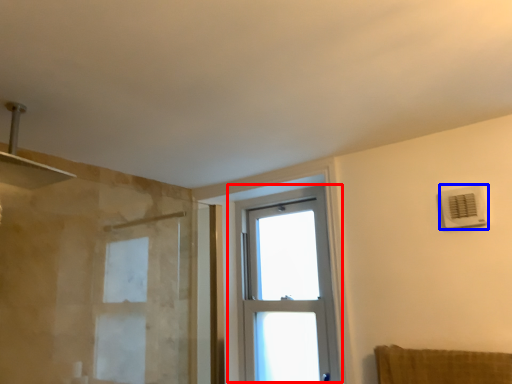
Question: Which object appears farthest to the camera in this image, window (highlighted by a red box) or air conditioning (highlighted by a blue box)?

Choices:
 (A) window
 (B) air conditioning

Answer: (A)